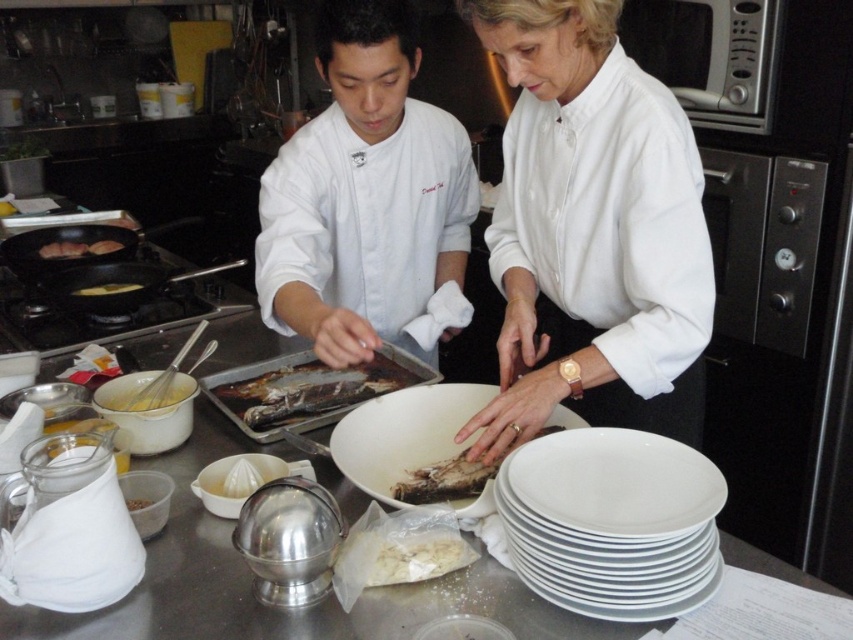
Based on the scene description, where is the smooth white shirt at center located in the image?

The smooth white shirt at center is located at point 2D coordinates of (592, 230).